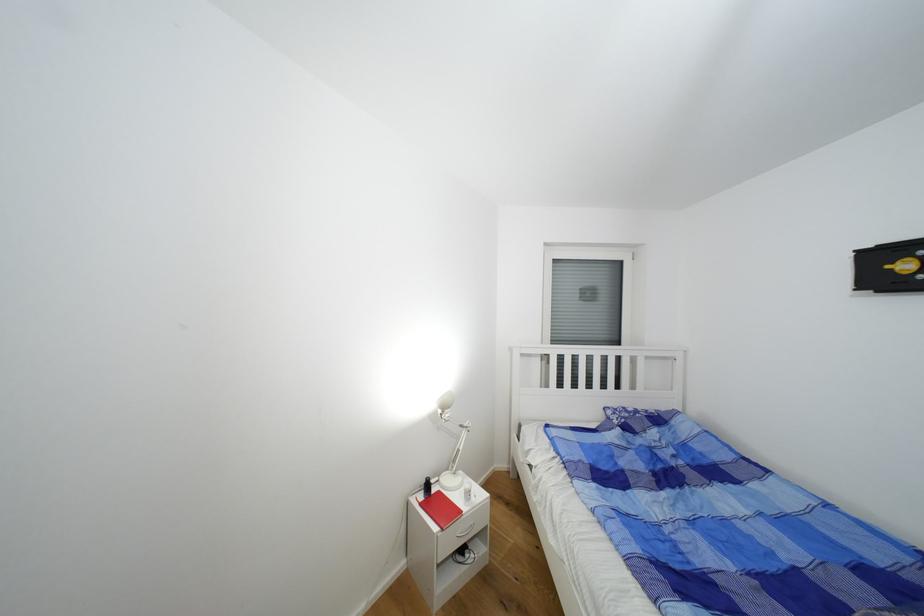
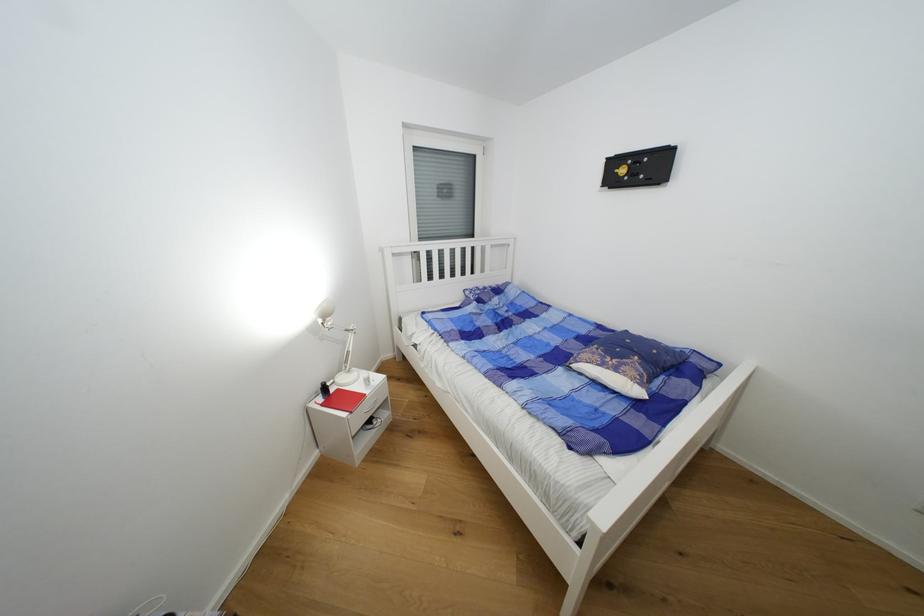
The point at (x=444, y=493) is marked in the first image. Where is the corresponding point in the second image?

(344, 392)